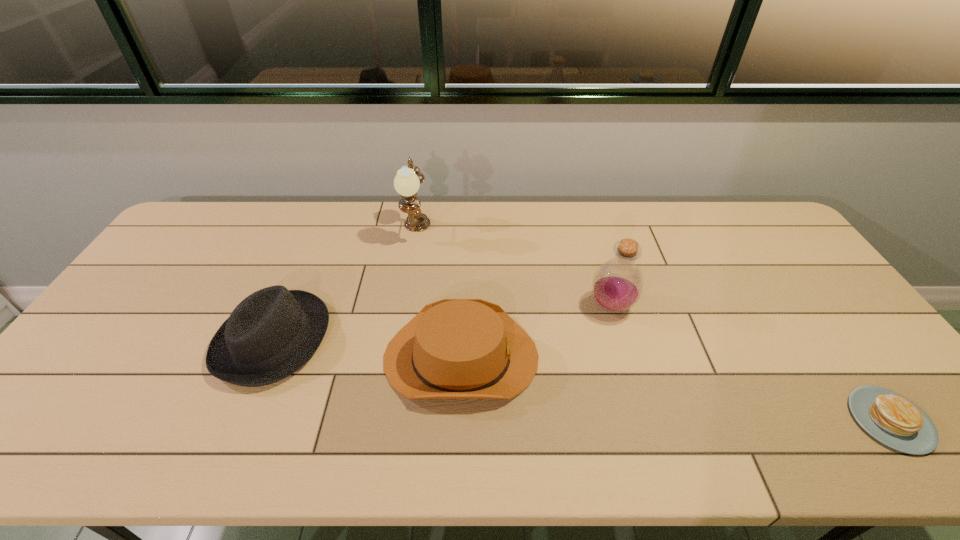
This screenshot has width=960, height=540. I want to click on the tallest object, so click(x=407, y=181).

Identify the location of oil lamp. (407, 181).

Identify the location of the fourth shortest object. The height and width of the screenshot is (540, 960). (617, 285).

This screenshot has height=540, width=960. Find the location of `bottle`. bottle is located at coordinates (617, 285).

The width and height of the screenshot is (960, 540). I want to click on fedora, so click(x=273, y=332).

In order to click on the fourth tallest object in this screenshot , I will do `click(454, 348)`.

The height and width of the screenshot is (540, 960). In order to click on the rightmost object in this screenshot , I will do `click(891, 418)`.

What are the coordinates of `pancake` in the screenshot? It's located at (891, 418).

This screenshot has width=960, height=540. What are the coordinates of `free region located on the front of the oil lamp` in the screenshot? It's located at (407, 287).

You are a GUI agent. You are given a task and a screenshot of the screen. Output one action in this format:
    pyautogui.click(x=<x>, y=<y>)
    Task: Click on the free spot located on the back of the fourth object from left to right
    This screenshot has width=960, height=540.
    Given the screenshot: What is the action you would take?
    pyautogui.click(x=586, y=218)